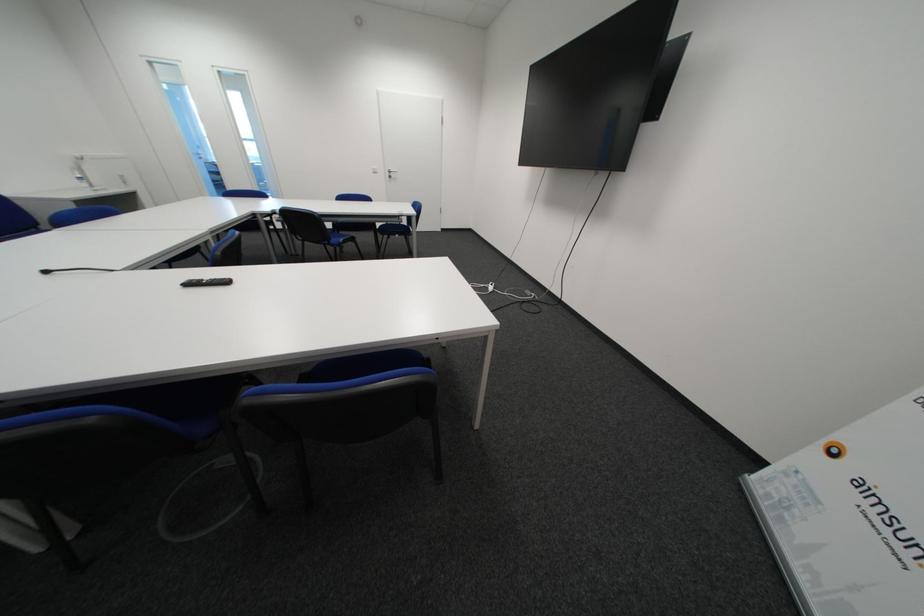
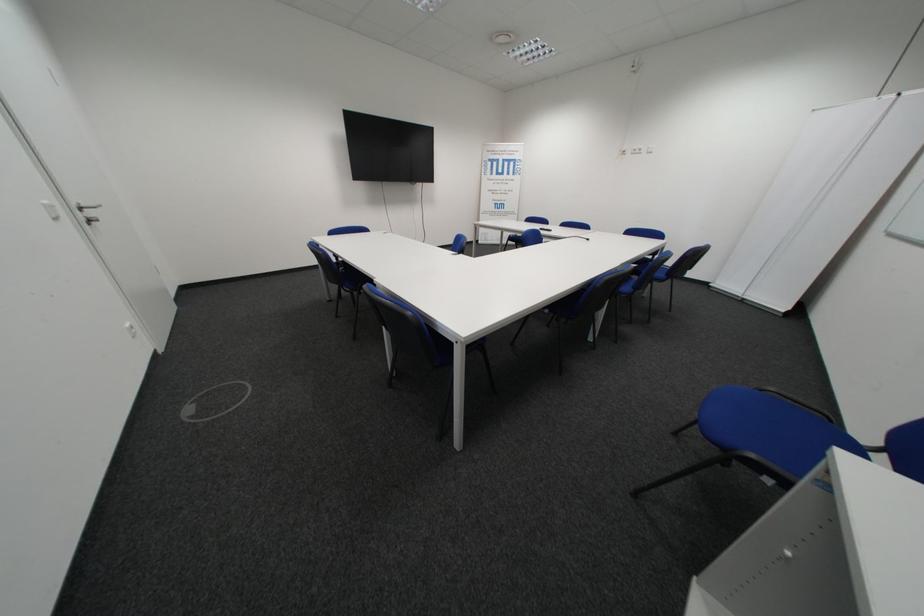
Locate, in the second image, the point that corresponds to the point at 402,172 in the first image.

(93, 209)